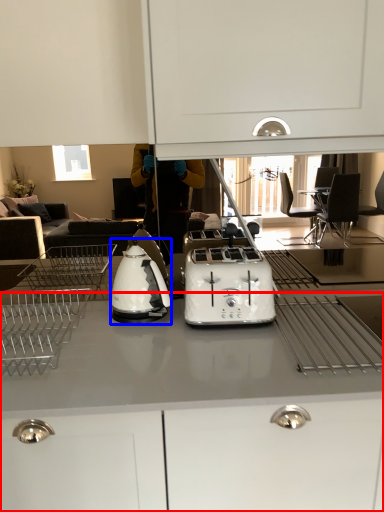
Question: Which point is closer to the camera, cabinetry (highlighted by a red box) or kitchen appliance (highlighted by a blue box)?

Choices:
 (A) cabinetry
 (B) kitchen appliance

Answer: (A)